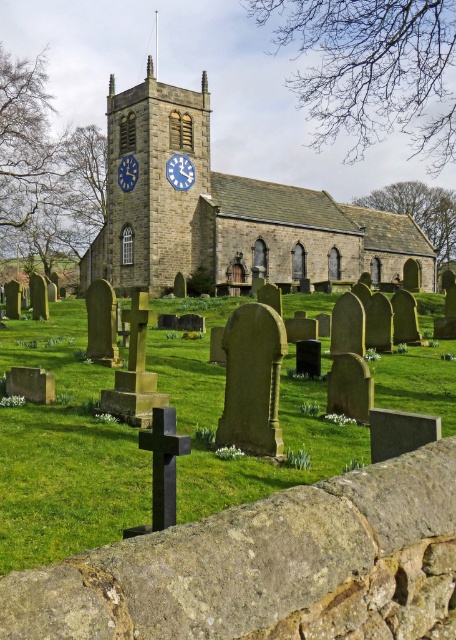
You are standing in front of the churchyard and want to walk towards the green grass at center. Which direction should you move relative to the stone clock tower at center?

The green grass at center is located below the stone clock tower at center, so you should move downward towards the green grass at center relative to the stone clock tower at center.

You are standing in the churchyard and want to place a small flowerpot exactly at the center of the green grass at center. According to the coordinates provided, where should you place the flowerpot?

The green grass at center is located at point (65, 452), so you should place the flowerpot at those coordinates to position it exactly at the center of the green grass at center.

You are a gardener tasked with mowing the green grass at center and the stone clock tower at center. Which object requires a lawn mower to be adjusted to a lower height setting?

The green grass at center is thinner than the stone clock tower at center, so the lawn mower should be adjusted to a lower height setting for the green grass at center.